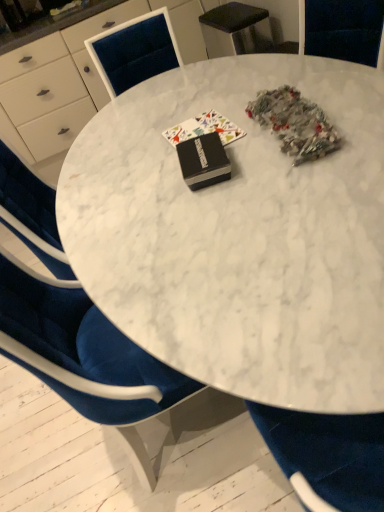
The image size is (384, 512). In order to click on vacant space behind black matte book at center, which appears as the first book when viewed from the back in this screenshot , I will do `click(181, 110)`.